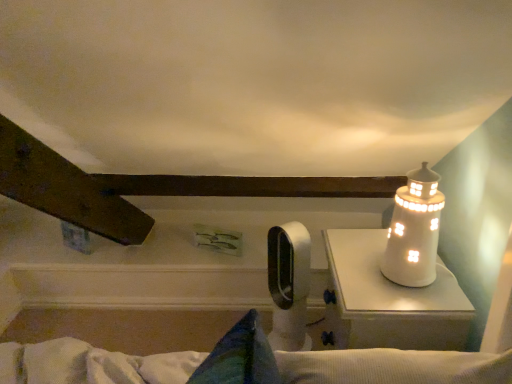
Question: Would you consider white glossy lighthouse at right to be distant from white ceramic lighthouse at upper right?

Choices:
 (A) yes
 (B) no

Answer: (B)

Question: Considering the relative sizes of white glossy lighthouse at right and white ceramic lighthouse at upper right in the image provided, is white glossy lighthouse at right bigger than white ceramic lighthouse at upper right?

Choices:
 (A) yes
 (B) no

Answer: (A)

Question: From a real-world perspective, is white glossy lighthouse at right positioned over white ceramic lighthouse at upper right based on gravity?

Choices:
 (A) no
 (B) yes

Answer: (A)

Question: Can you confirm if white glossy lighthouse at right is smaller than white ceramic lighthouse at upper right?

Choices:
 (A) yes
 (B) no

Answer: (B)

Question: Can you confirm if white glossy lighthouse at right is shorter than white ceramic lighthouse at upper right?

Choices:
 (A) yes
 (B) no

Answer: (B)

Question: Considering the positions of white plastic fan at center and white ceramic lighthouse at upper right in the image, is white plastic fan at center wider or thinner than white ceramic lighthouse at upper right?

Choices:
 (A) thin
 (B) wide

Answer: (B)

Question: Based on their sizes in the image, would you say white plastic fan at center is bigger or smaller than white ceramic lighthouse at upper right?

Choices:
 (A) big
 (B) small

Answer: (A)

Question: From the image's perspective, relative to white ceramic lighthouse at upper right, is white plastic fan at center above or below?

Choices:
 (A) below
 (B) above

Answer: (A)

Question: From a real-world perspective, relative to white ceramic lighthouse at upper right, is white plastic fan at center vertically above or below?

Choices:
 (A) above
 (B) below

Answer: (B)

Question: In the image, is white glossy lighthouse at right on the left side or the right side of white plastic fan at center?

Choices:
 (A) left
 (B) right

Answer: (B)

Question: From the image's perspective, is white glossy lighthouse at right located above or below white plastic fan at center?

Choices:
 (A) below
 (B) above

Answer: (A)

Question: In terms of size, does white glossy lighthouse at right appear bigger or smaller than white plastic fan at center?

Choices:
 (A) big
 (B) small

Answer: (A)

Question: Is white glossy lighthouse at right in front of or behind white plastic fan at center in the image?

Choices:
 (A) front
 (B) behind

Answer: (A)

Question: From a real-world perspective, is white plastic fan at center physically located above or below white glossy lighthouse at right?

Choices:
 (A) above
 (B) below

Answer: (B)

Question: Does point (281, 319) appear closer or farther from the camera than point (452, 345)?

Choices:
 (A) farther
 (B) closer

Answer: (A)